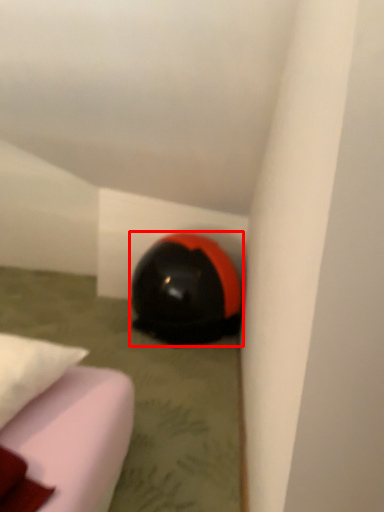
Question: Where is helmet (annotated by the red box) located in relation to pillow in the image?

Choices:
 (A) right
 (B) left

Answer: (A)